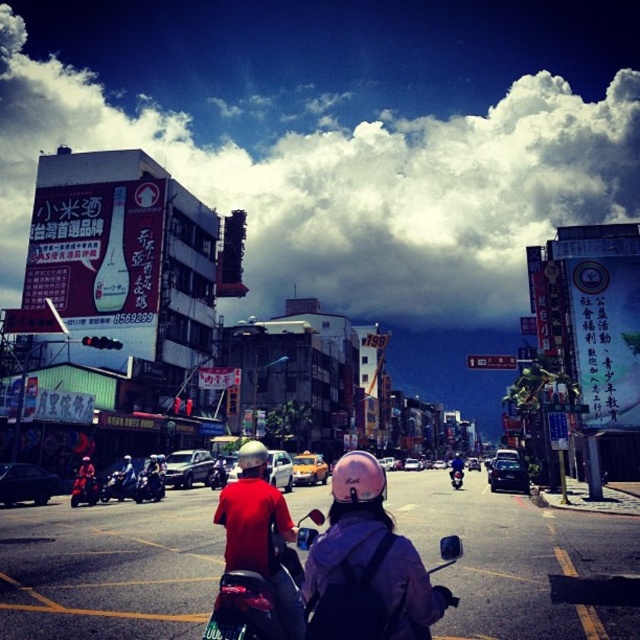
You are riding a motorbike and wearing a helmet. You need to check if your helmet is positioned correctly on your head. The red matte helmet at center is the one you are wearing. According to the image, where exactly is your helmet located in relation to the motorbike?

The red matte helmet at center is located at the coordinates point (259, 531) on the motorbike.

Based on the photo, you are riding a motorbike and looking forward. There are two points marked on the road ahead. The first point is at coordinates point (236, 508) and the second point is at point (76, 483). Which point will you reach first?

Point (236, 508) is closer to the camera than point (76, 483), so you will reach point (236, 508) first.